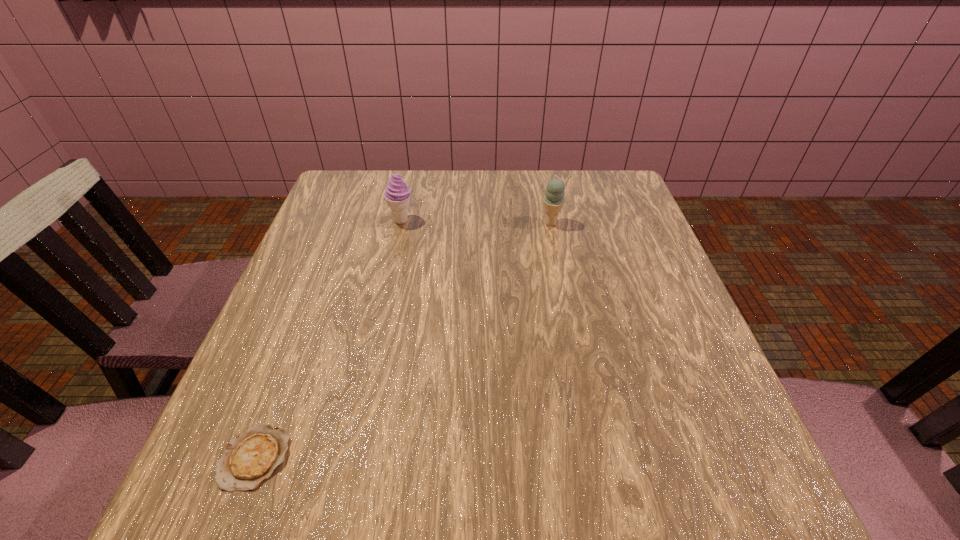
Locate an element on the screen. The image size is (960, 540). free space between the second object from right to left and the rightmost object is located at coordinates (476, 222).

The height and width of the screenshot is (540, 960). Find the location of `empty location between the right ice cream and the leftmost object`. empty location between the right ice cream and the leftmost object is located at coordinates (403, 340).

At what (x,y) coordinates should I click in order to perform the action: click on free space between the second object from right to left and the right ice cream. Please return your answer as a coordinate pair (x, y). The width and height of the screenshot is (960, 540). Looking at the image, I should click on (476, 222).

In order to click on blank region between the rightmost object and the second object from right to left in this screenshot , I will do `click(476, 222)`.

You are a GUI agent. You are given a task and a screenshot of the screen. Output one action in this format:
    pyautogui.click(x=<x>, y=<y>)
    Task: Click on the empty space between the left ice cream and the rightmost object
    The width and height of the screenshot is (960, 540).
    Given the screenshot: What is the action you would take?
    pyautogui.click(x=476, y=222)

In order to click on free spot between the rightmost object and the second object from left to right in this screenshot , I will do `click(476, 222)`.

Locate which object is the closest to the second object from left to right. Please provide its 2D coordinates. Your answer should be formatted as a tuple, i.e. [(x, y)], where the tuple contains the x and y coordinates of a point satisfying the conditions above.

[(553, 200)]

Locate an element on the screen. Image resolution: width=960 pixels, height=540 pixels. object identified as the closest to the quiche is located at coordinates (397, 195).

Locate an element on the screen. The width and height of the screenshot is (960, 540). vacant position in the image that satisfies the following two spatial constraints: 1. on the back side of the nearest object; 2. on the right side of the right ice cream is located at coordinates (344, 223).

You are a GUI agent. You are given a task and a screenshot of the screen. Output one action in this format:
    pyautogui.click(x=<x>, y=<y>)
    Task: Click on the vacant space that satisfies the following two spatial constraints: 1. on the back side of the shortest object; 2. on the right side of the second object from left to right
    
    Given the screenshot: What is the action you would take?
    pyautogui.click(x=345, y=220)